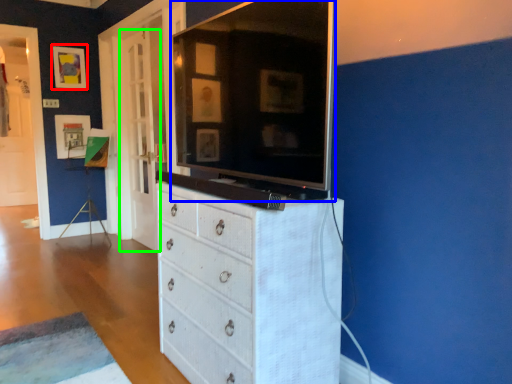
Question: Which object is positioned closest to picture frame (highlighted by a red box)? Select from tv cabinet (highlighted by a blue box) and door (highlighted by a green box).

Choices:
 (A) tv cabinet
 (B) door

Answer: (B)